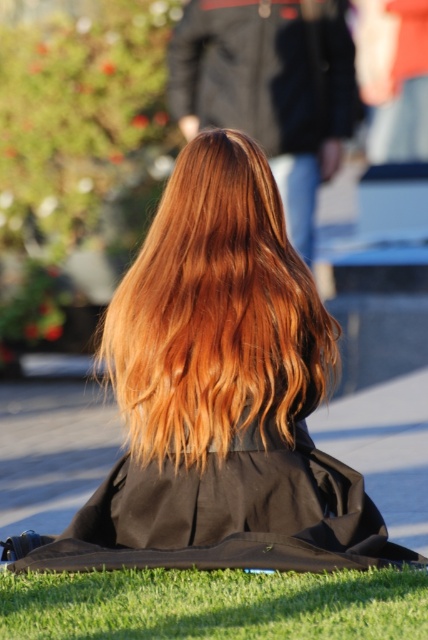
You are standing in the scene and want to move from point (220, 452) to point (404, 580). Which direction should you face to walk towards the destination?

You should face away from the viewer because point (404, 580) is further away from you than point (220, 452).

You are a photographer trying to capture the person in the image. Since the shiny black robe at center is reflecting light, which object should you adjust your camera focus on to ensure the green grass at lower center is clearly visible?

The green grass at lower center is positioned under the shiny black robe at center, so adjusting the focus on the shiny black robe at center will help ensure the grass beneath is in clear focus.

You are a photographer trying to capture the shiny copper hair at center and the green grass at lower center in a single frame. Which object will appear bigger in your photo?

The shiny copper hair at center will appear bigger in the photo because it is larger in size than the green grass at lower center.